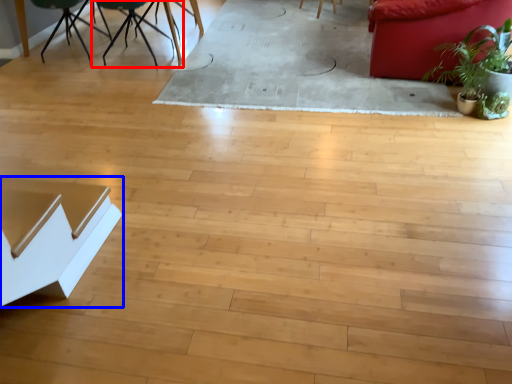
Question: Which object appears closest to the camera in this image, chair (highlighted by a red box) or table (highlighted by a blue box)?

Choices:
 (A) chair
 (B) table

Answer: (B)